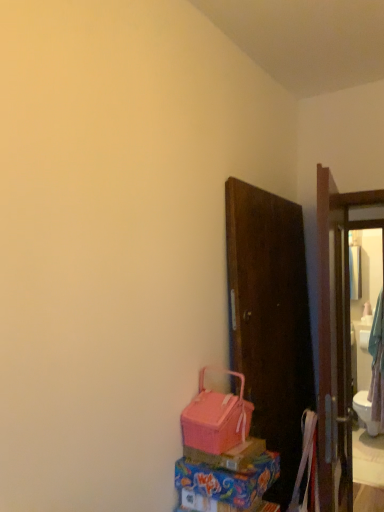
Question: From a real-world perspective, is pink fabric basket at lower center above or below pink plastic box at lower center, arranged as the second box when ordered from the bottom?

Choices:
 (A) above
 (B) below

Answer: (A)

Question: Is pink fabric basket at lower center bigger or smaller than pink plastic box at lower center, arranged as the 1th box when viewed from the top?

Choices:
 (A) small
 (B) big

Answer: (B)

Question: Which of these objects is positioned farthest from the matte pink plastic box at lower center, which is the second box in top-to-bottom order?

Choices:
 (A) pink plastic box at lower center, arranged as the second box when ordered from the bottom
 (B) matte glass mirror at right
 (C) pink fabric basket at lower center

Answer: (B)

Question: Which object is the closest to the pink plastic box at lower center, arranged as the second box when ordered from the bottom?

Choices:
 (A) matte glass mirror at right
 (B) matte pink plastic box at lower center, which ranks as the 1th box in bottom-to-top order
 (C) pink fabric basket at lower center

Answer: (B)